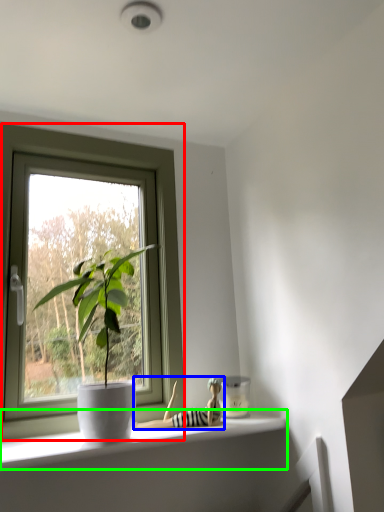
Question: Based on their relative distances, which object is nearer to window (highlighted by a red box)? Choose from toy (highlighted by a blue box) and window sill (highlighted by a green box).

Choices:
 (A) toy
 (B) window sill

Answer: (B)